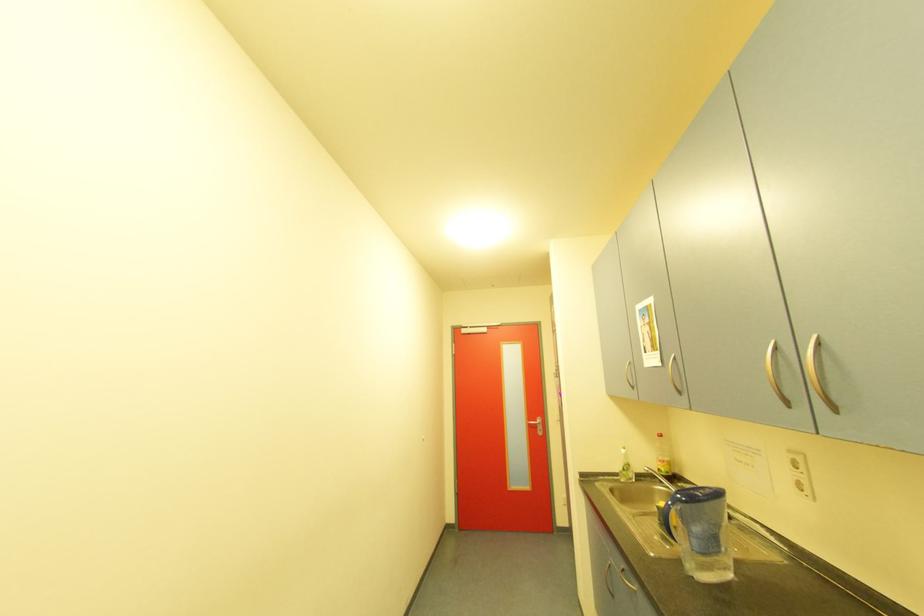
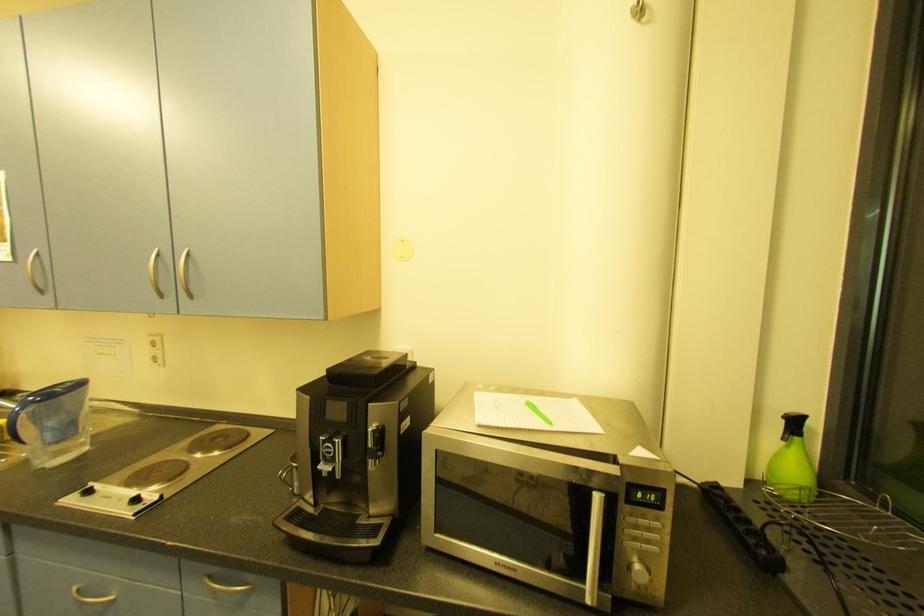
Question: Based on the continuous images, in which direction is the camera rotating? Reply with the corresponding letter.

Choices:
 (A) Left
 (B) Right
 (C) Up
 (D) Down

Answer: (B)